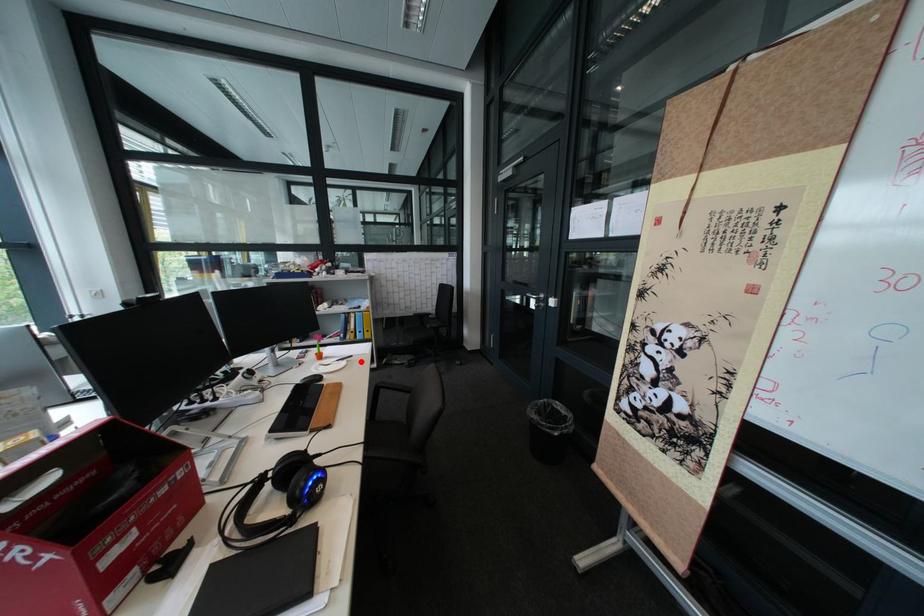
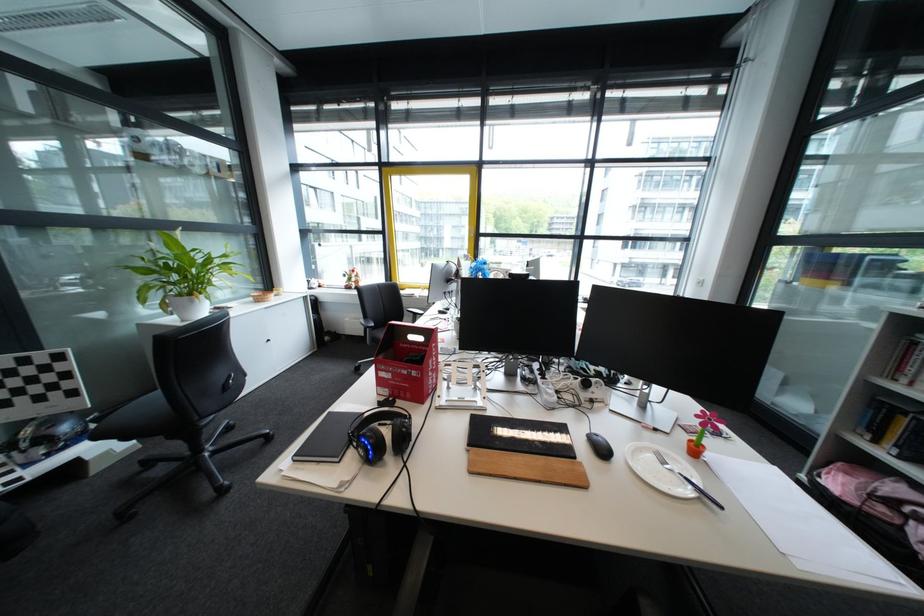
Question: A red point is marked in image1. In image2, is the corresponding 3D point closer to the camera or farther? Reply with the corresponding letter.

Choices:
 (A) The corresponding 3D point is closer.
 (B) The corresponding 3D point is farther.

Answer: (B)